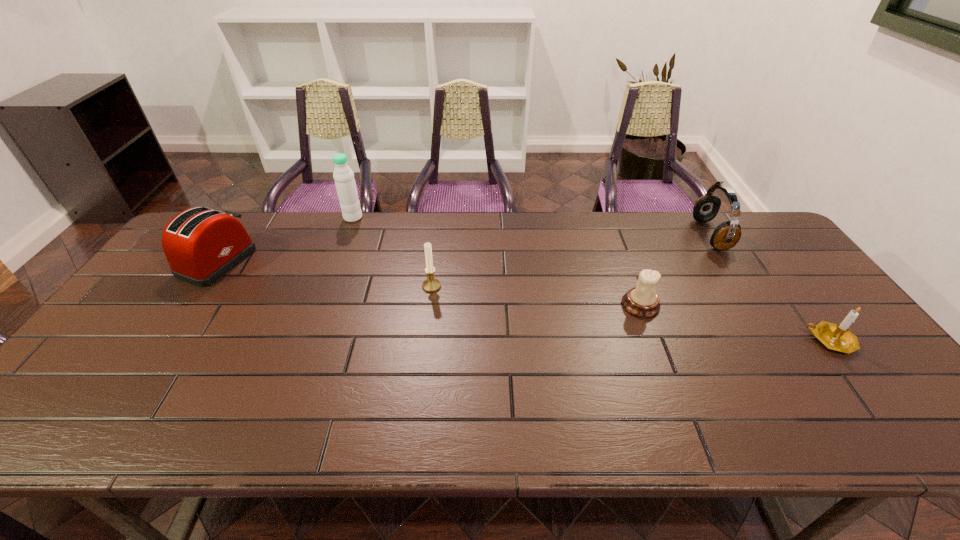
This screenshot has width=960, height=540. Find the location of `object positioned at the left edge`. object positioned at the left edge is located at coordinates (201, 245).

The width and height of the screenshot is (960, 540). Identify the location of headset that is at the right edge. [x=726, y=235].

Where is `candle holder that is at the right edge`? This screenshot has width=960, height=540. candle holder that is at the right edge is located at coordinates [837, 337].

Find the location of a particular element. The height and width of the screenshot is (540, 960). object that is at the far left corner is located at coordinates (201, 245).

The height and width of the screenshot is (540, 960). I want to click on object that is positioned at the far right corner, so click(726, 235).

This screenshot has height=540, width=960. What are the coordinates of `blank space at the far edge of the desktop` in the screenshot? It's located at (469, 233).

You are a GUI agent. You are given a task and a screenshot of the screen. Output one action in this format:
    pyautogui.click(x=<x>, y=<y>)
    Task: Click on the free space at the near edge of the desktop
    The width and height of the screenshot is (960, 540).
    Given the screenshot: What is the action you would take?
    pyautogui.click(x=248, y=434)

Identify the location of vacant space at the left edge. The height and width of the screenshot is (540, 960). (93, 350).

Image resolution: width=960 pixels, height=540 pixels. In order to click on free region at the right edge of the desktop in this screenshot , I will do `click(763, 285)`.

You are a GUI agent. You are given a task and a screenshot of the screen. Output one action in this format:
    pyautogui.click(x=<x>, y=<y>)
    Task: Click on the free space between the leftmost object and the fourth object from right to left
    
    Given the screenshot: What is the action you would take?
    pyautogui.click(x=324, y=274)